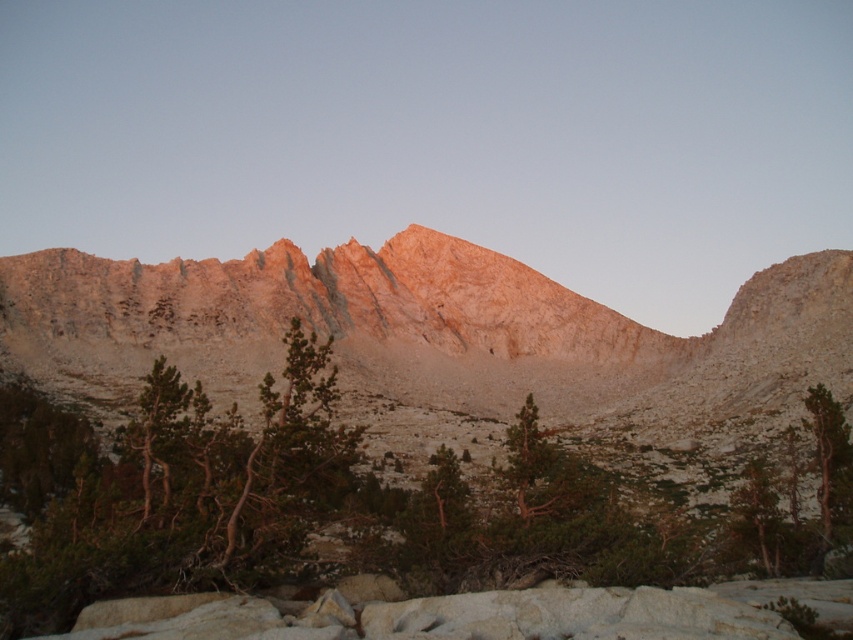
Question: Does green textured tree at center have a greater width compared to green textured tree at right?

Choices:
 (A) no
 (B) yes

Answer: (B)

Question: Does green textured tree at center have a larger size compared to green textured tree at right?

Choices:
 (A) yes
 (B) no

Answer: (A)

Question: Which point appears closest to the camera in this image?

Choices:
 (A) (625, 515)
 (B) (849, 509)

Answer: (A)

Question: Which point is farther from the camera taking this photo?

Choices:
 (A) (833, 508)
 (B) (668, 580)

Answer: (A)

Question: Among these points, which one is farthest from the camera?

Choices:
 (A) (314, 486)
 (B) (830, 484)

Answer: (B)

Question: Is green textured tree at center above green textured tree at right?

Choices:
 (A) yes
 (B) no

Answer: (A)